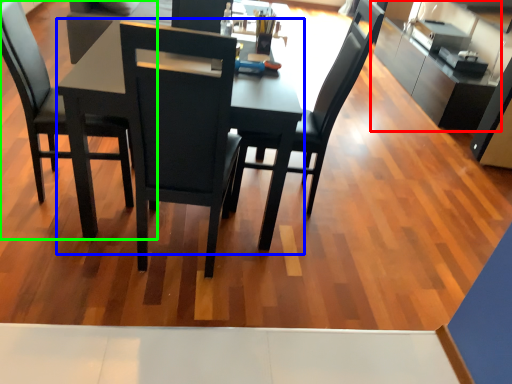
Question: Which is farther away from cabinetry (highlighted by a red box)? round table (highlighted by a blue box) or chair (highlighted by a green box)?

Choices:
 (A) round table
 (B) chair

Answer: (A)